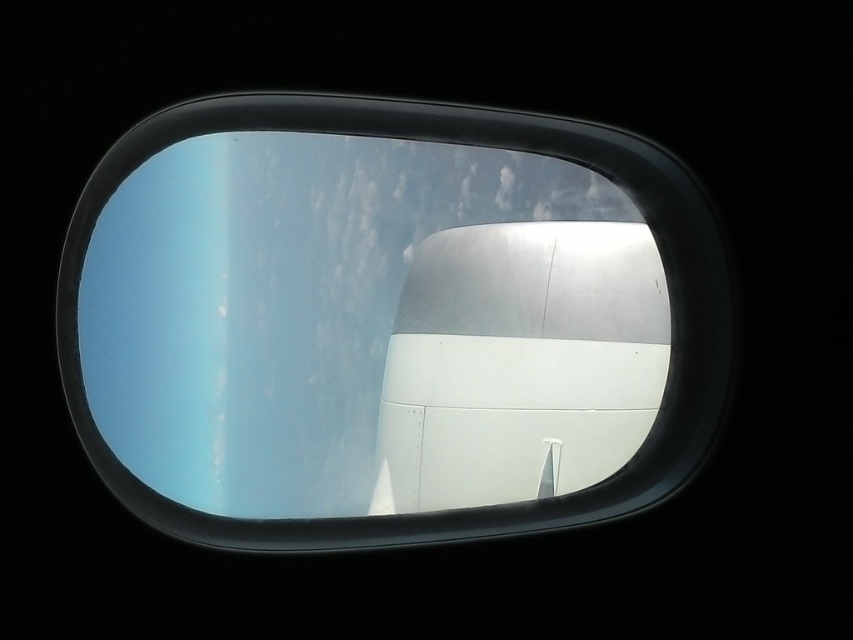
Question: Is transparent glass airplane window at center bigger than white matte airplane engine at center?

Choices:
 (A) yes
 (B) no

Answer: (A)

Question: Where is transparent glass airplane window at center located in relation to white matte airplane engine at center in the image?

Choices:
 (A) left
 (B) right

Answer: (A)

Question: In this image, where is transparent glass airplane window at center located relative to white matte airplane engine at center?

Choices:
 (A) below
 (B) above

Answer: (B)

Question: Among these points, which one is nearest to the camera?

Choices:
 (A) (492, 385)
 (B) (469, 259)

Answer: (A)

Question: Which point is closer to the camera taking this photo?

Choices:
 (A) (695, 269)
 (B) (497, 264)

Answer: (A)